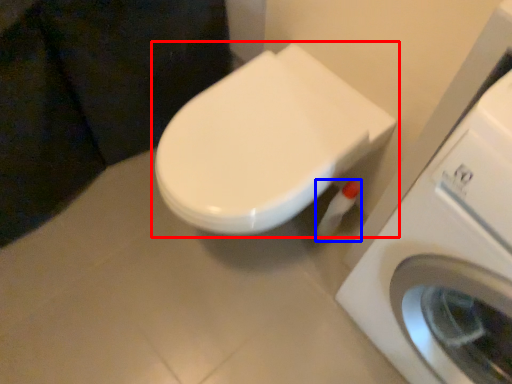
Question: Which point is further to the camera, toilet (highlighted by a red box) or toilet paper (highlighted by a blue box)?

Choices:
 (A) toilet
 (B) toilet paper

Answer: (B)